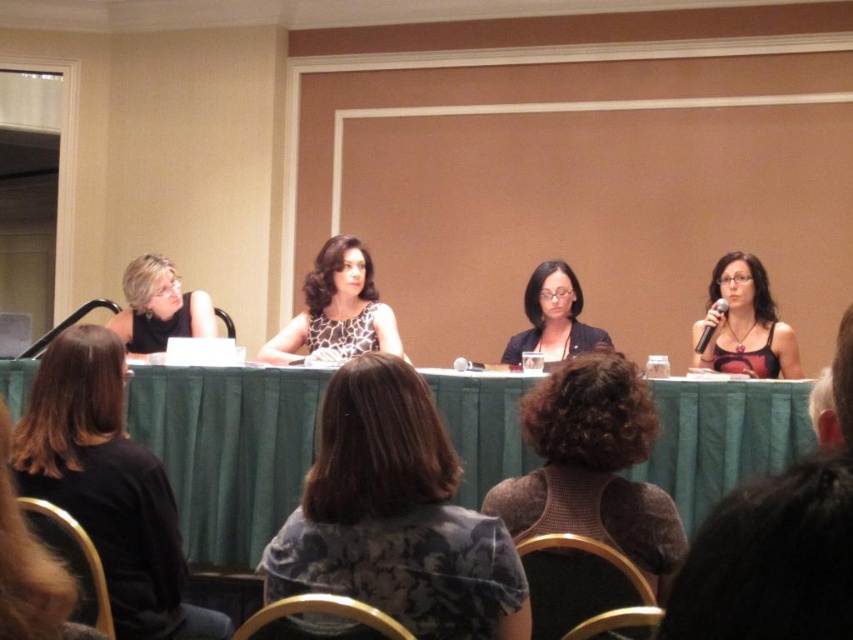
You are a photographer taking a picture of the panel discussion. You notice two points in the image at coordinates point (552,472) and point (157,305). Which point should you focus on to ensure it appears sharp in the photo?

You should focus on point (552,472) because it is closer to the camera than point (157,305), making it easier to capture sharply.

From the picture: You are organizing a presentation and need to place a 12 inch wide projector next to the green fabric table at center and the matte black laptop at left. Which object should you place it next to to ensure it fits without overlapping?

The green fabric table at center is wider than the matte black laptop at left, so placing the 12 inch wide projector next to the green fabric table at center would provide more space and prevent overlapping.

You are organizing a presentation and need to place a 12cm tall projector remote on the green fabric table at center and the matte black laptop at left. Which surface can accommodate the remote without it hanging off the edge?

The green fabric table at center is taller than the matte black laptop at left, so the projector remote can be placed on the green fabric table at center since it has enough height to accommodate the remote without it hanging off.